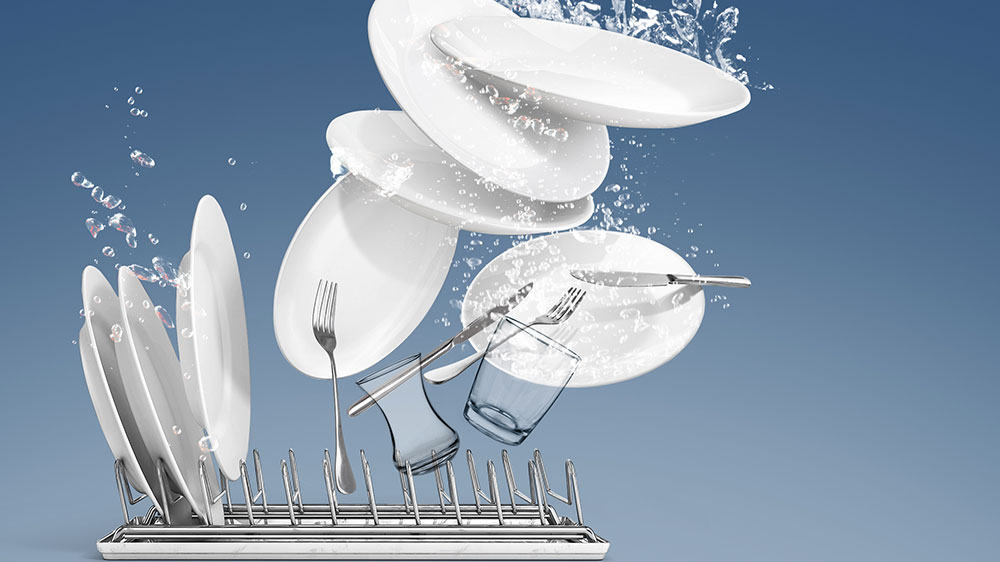
Find the location of a particular element. This screenshot has height=562, width=1000. plate is located at coordinates (110, 407), (155, 385), (223, 343), (380, 265), (402, 173), (462, 126), (568, 76), (619, 336).